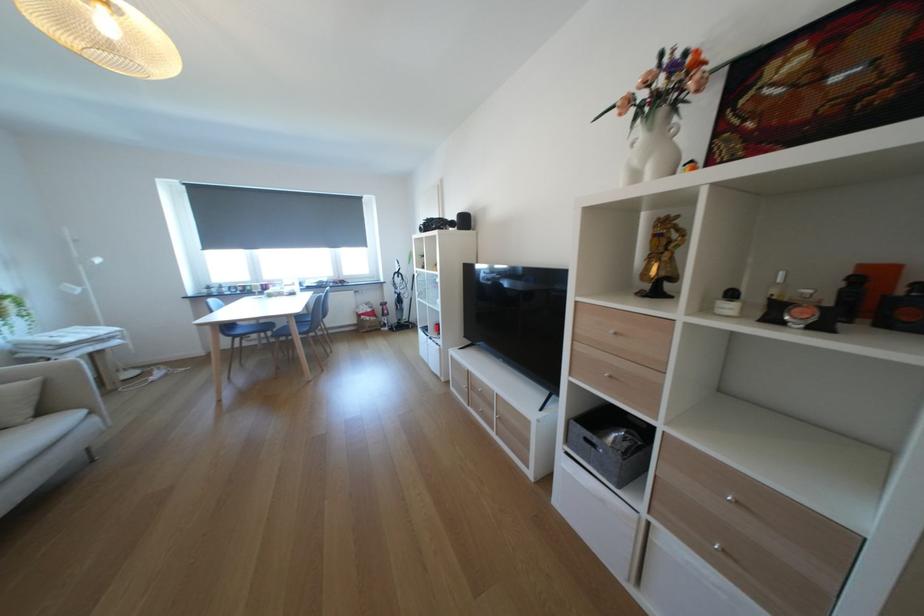
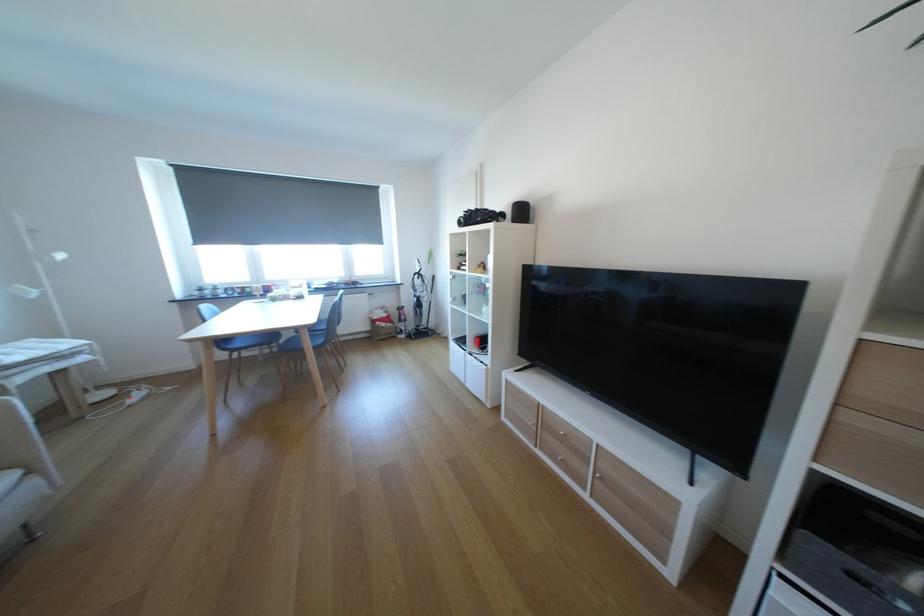
The point at [463,225] is marked in the first image. Where is the corresponding point in the second image?

(514, 217)